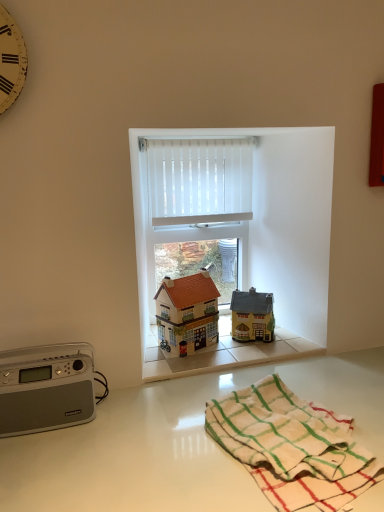
The width and height of the screenshot is (384, 512). What are the coordinates of `free space in front of silver metallic radio at left` in the screenshot? It's located at (46, 463).